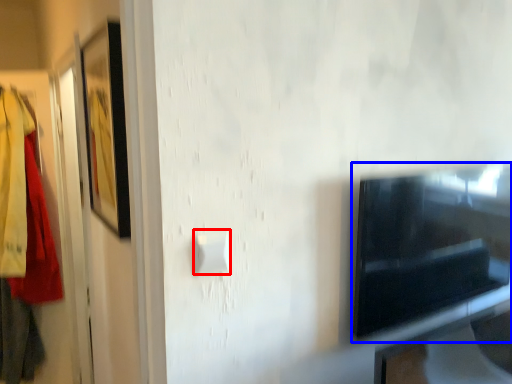
Question: Which object is closer to the camera taking this photo, light switch (highlighted by a red box) or appliance (highlighted by a blue box)?

Choices:
 (A) light switch
 (B) appliance

Answer: (A)